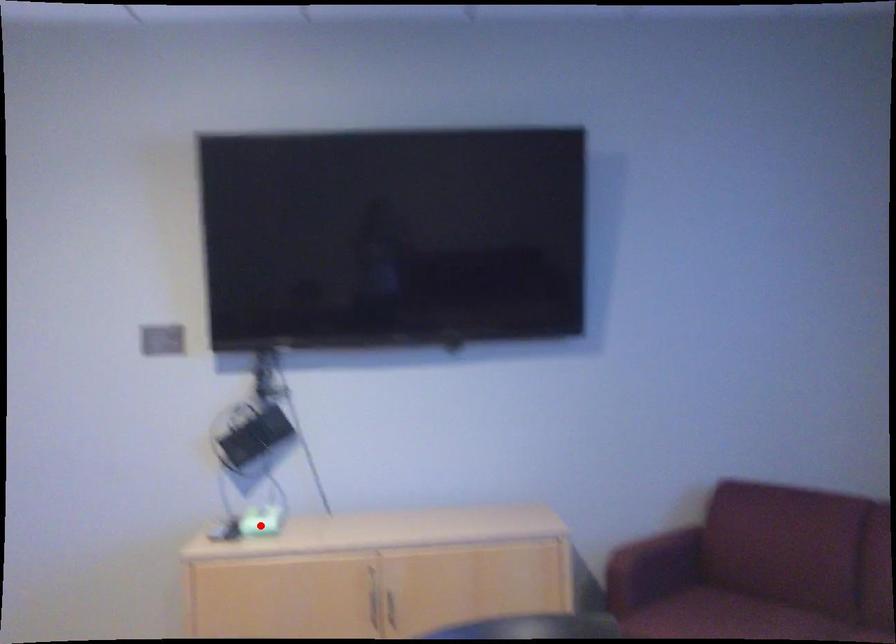
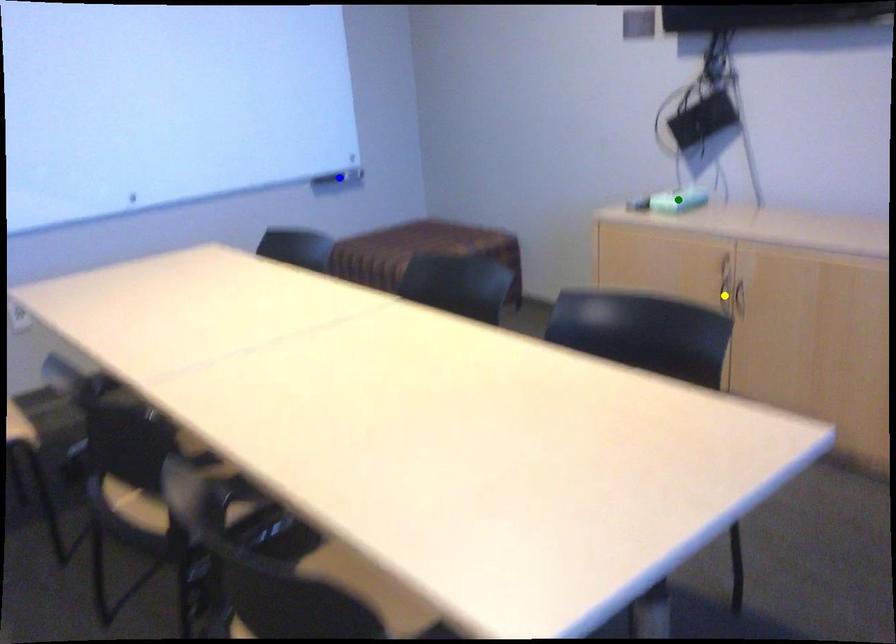
Question: I am providing you with two images of the same scene from different viewpoints. A red point is marked on the first image. You are given multiple points on the second image. Which mark in image 2 goes with the point in image 1?

Choices:
 (A) green point
 (B) yellow point
 (C) blue point

Answer: (A)